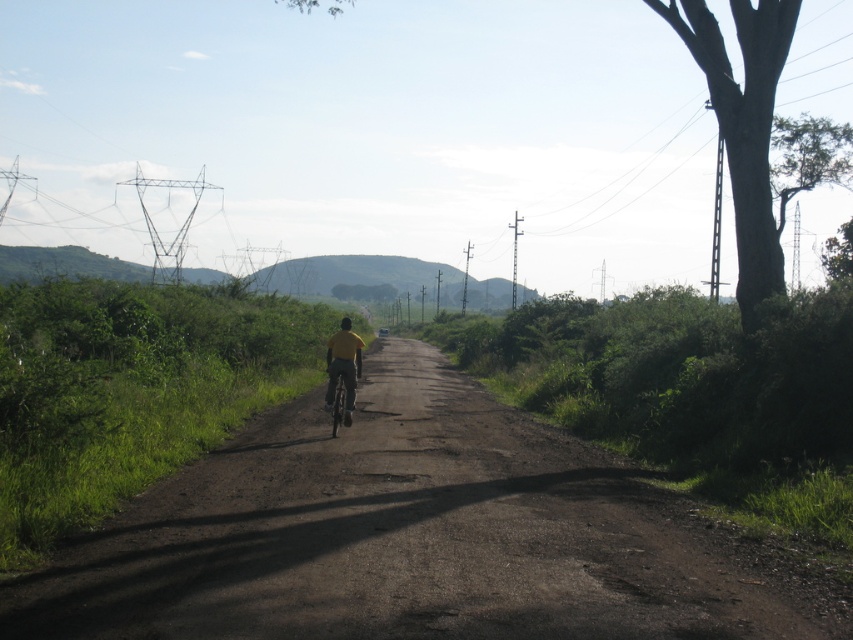
Is dirt road at center closer to the viewer compared to yellow fabric at center?

Yes, dirt road at center is closer to the viewer.

In the scene shown: Between dirt road at center and yellow fabric at center, which one appears on the right side from the viewer's perspective?

dirt road at center

Where is `dirt road at center`? The width and height of the screenshot is (853, 640). dirt road at center is located at coordinates (416, 536).

Find the location of a particular element. The width and height of the screenshot is (853, 640). dirt road at center is located at coordinates coord(416,536).

Which is below, yellow fabric at center or metallic silver bicycle at center?

metallic silver bicycle at center is below.

Does yellow fabric at center have a greater width compared to metallic silver bicycle at center?

Yes, yellow fabric at center is wider than metallic silver bicycle at center.

Where is `yellow fabric at center`? The width and height of the screenshot is (853, 640). yellow fabric at center is located at coordinates (343, 365).

Locate an element on the screen. The height and width of the screenshot is (640, 853). yellow fabric at center is located at coordinates (343, 365).

Between dirt road at center and metallic silver bicycle at center, which one is positioned lower?

Positioned lower is dirt road at center.

Measure the distance between dirt road at center and camera.

The distance of dirt road at center from camera is 5.14 meters.

Which is behind, point (143, 550) or point (343, 422)?

Point (343, 422)

Where is `dirt road at center`? dirt road at center is located at coordinates (416, 536).